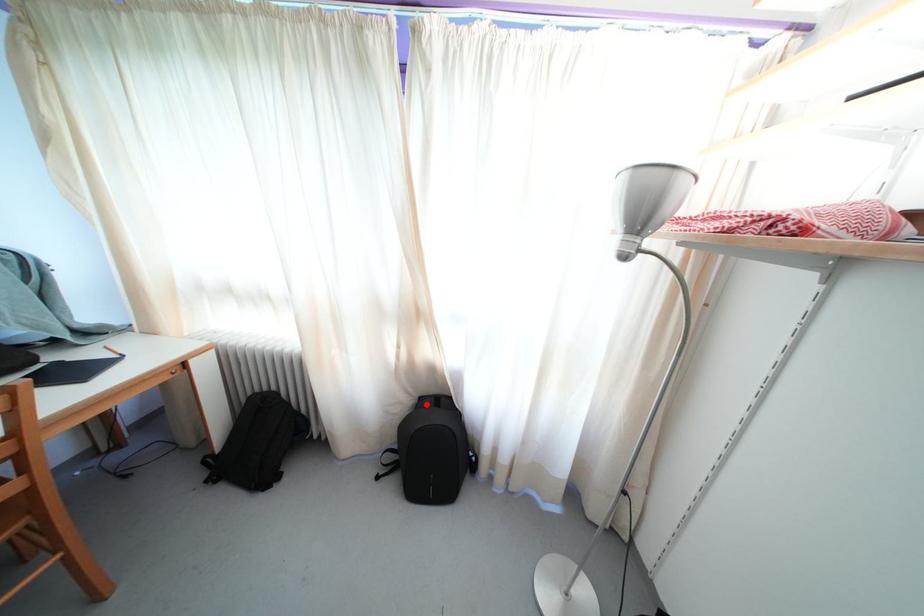
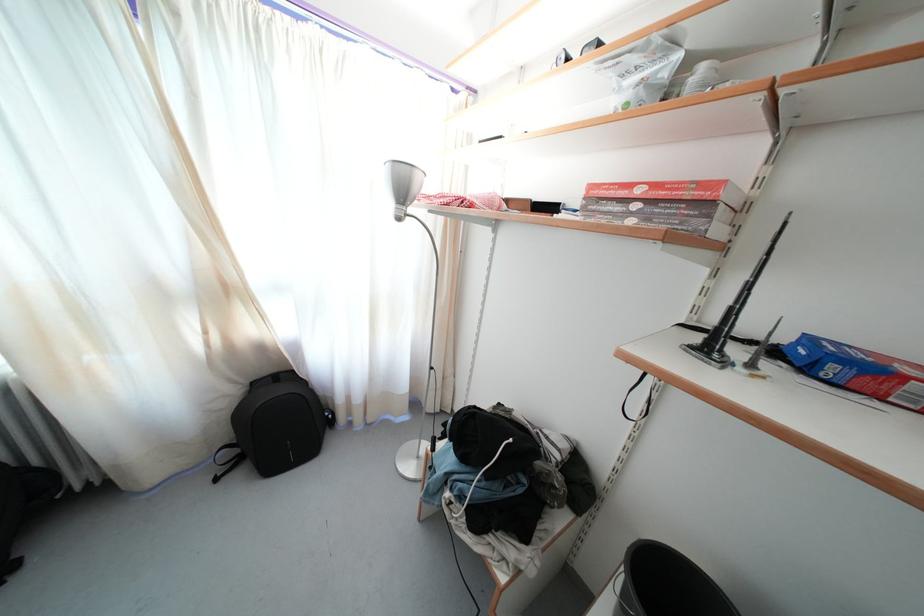
Question: I am providing you with two images of the same scene from different viewpoints. Image1 has a red point marked. In image2, the corresponding 3D location appears at what relative position? Reply with the corresponding letter.

Choices:
 (A) Closer
 (B) Farther

Answer: (A)